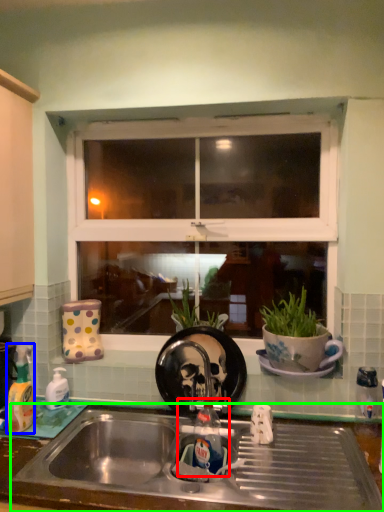
Question: Estimate the real-world distances between objects in this image. Which object is closer to tap (highlighted by a red box), bottle (highlighted by a blue box) or sink (highlighted by a green box)?

Choices:
 (A) bottle
 (B) sink

Answer: (B)